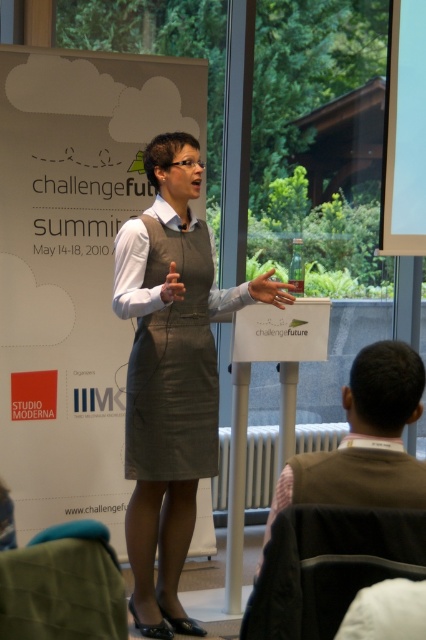
Which is below, gray leather dress at center or brown fabric vest at lower right?

brown fabric vest at lower right

Is point (154, 346) in front of point (371, 365)?

No, it is behind (371, 365).

Who is more forward, (138,461) or (380,358)?

Positioned in front is point (380,358).

Where is `gray leather dress at center`? gray leather dress at center is located at coordinates (173, 365).

Does matte gray dress at center appear on the right side of gray leather dress at center?

Indeed, matte gray dress at center is positioned on the right side of gray leather dress at center.

Does matte gray dress at center have a smaller size compared to gray leather dress at center?

Incorrect, matte gray dress at center is not smaller in size than gray leather dress at center.

Is point (141, 260) closer to viewer compared to point (129, 436)?

That is True.

You are a GUI agent. You are given a task and a screenshot of the screen. Output one action in this format:
    pyautogui.click(x=<x>, y=<y>)
    Task: Click on the matte gray dress at center
    
    Given the screenshot: What is the action you would take?
    pyautogui.click(x=170, y=374)

Is matte gray dress at center to the left of brown fabric vest at lower right from the viewer's perspective?

Indeed, matte gray dress at center is positioned on the left side of brown fabric vest at lower right.

Measure the distance from matte gray dress at center to brown fabric vest at lower right.

matte gray dress at center and brown fabric vest at lower right are 4.64 feet apart from each other.

Is point (152, 468) farther from camera compared to point (422, 372)?

Yes.

This screenshot has height=640, width=426. Identify the location of matte gray dress at center. (170, 374).